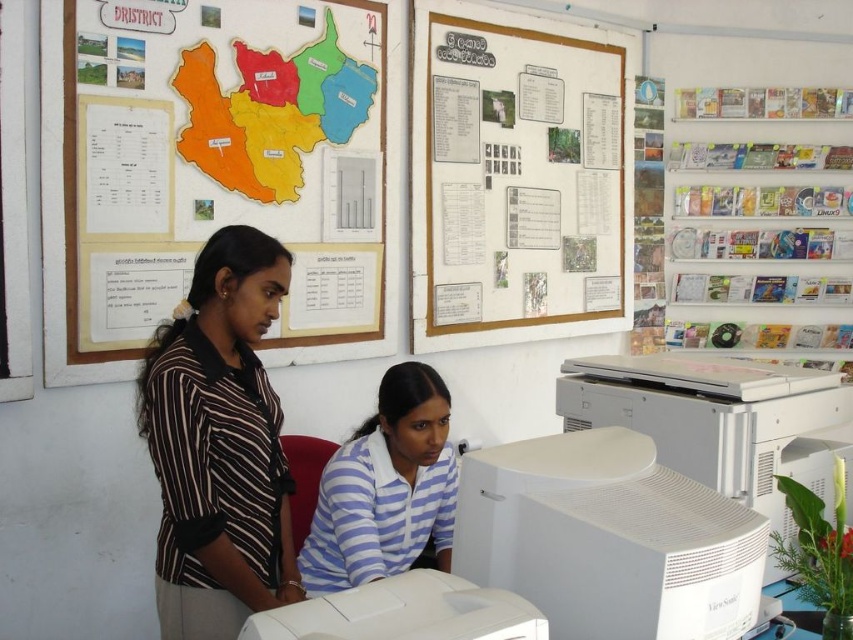
Is point (73, 376) farther from camera compared to point (508, 332)?

No, (73, 376) is closer to viewer.

Is point (329, 228) farther from camera compared to point (410, 268)?

No, (329, 228) is closer to viewer.

What are the coordinates of `colored paper map at upper left` in the screenshot? It's located at (218, 168).

Between striped cotton shirt at center and white plastic computer monitor at center, which one has more height?

striped cotton shirt at center

This screenshot has width=853, height=640. I want to click on striped cotton shirt at center, so [x=219, y=444].

Between white matte computer monitor at lower center and white plastic printer at lower right, which one is positioned lower?

Positioned lower is white matte computer monitor at lower center.

Where is `white matte computer monitor at lower center`? The height and width of the screenshot is (640, 853). white matte computer monitor at lower center is located at coordinates (608, 538).